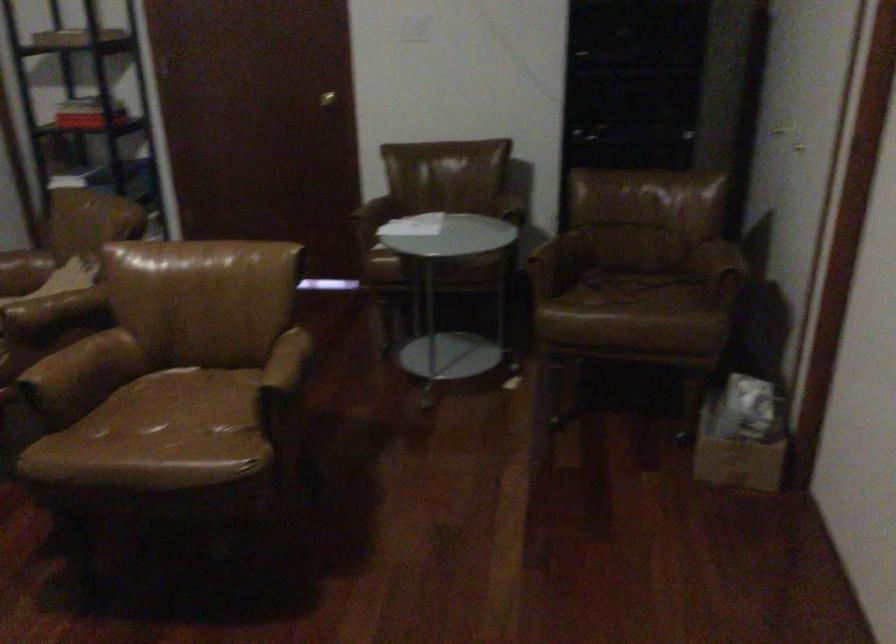
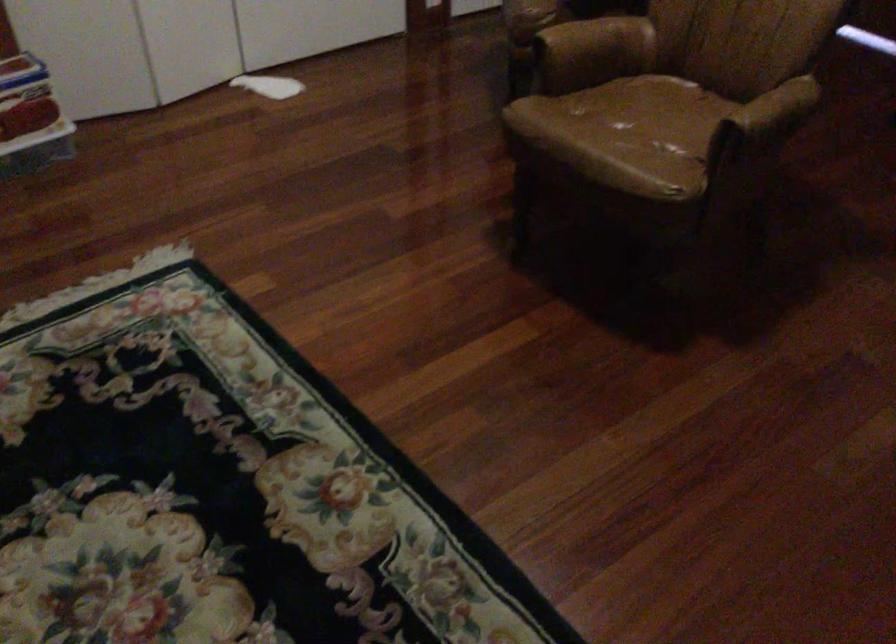
Where in the second image is the point corresponding to the point at 182,399 from the first image?

(661, 109)